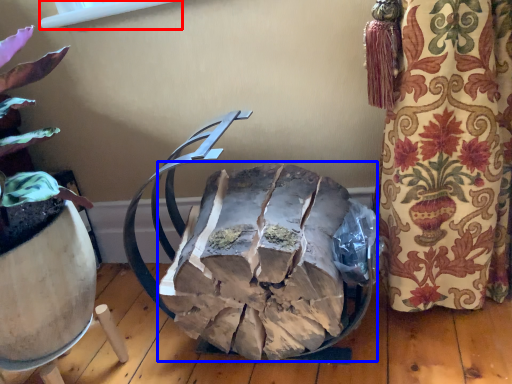
Question: Among these objects, which one is farthest to the camera, window screen (highlighted by a red box) or waste (highlighted by a blue box)?

Choices:
 (A) window screen
 (B) waste

Answer: (A)